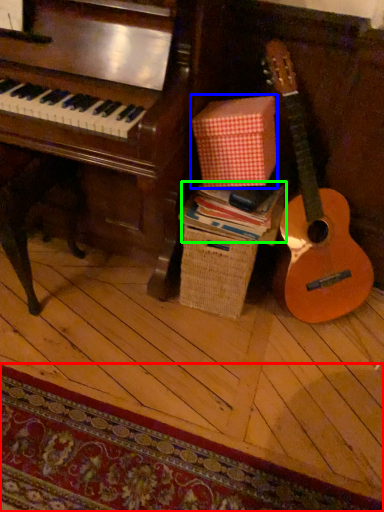
Question: Which is nearer to the mat (highlighted by a red box)? cardboard box (highlighted by a blue box) or book (highlighted by a green box).

Choices:
 (A) cardboard box
 (B) book

Answer: (B)